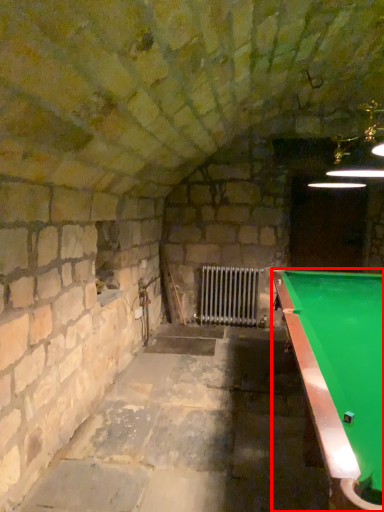
Question: In this image, where is billiard table (annotated by the red box) located relative to radiator?

Choices:
 (A) left
 (B) right

Answer: (B)